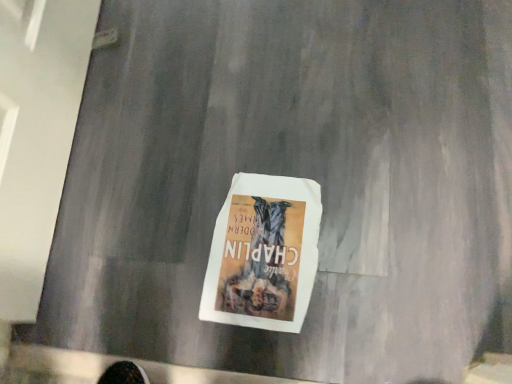
Where is `unoccupied region to the right of white paper at center`? unoccupied region to the right of white paper at center is located at coordinates (365, 216).